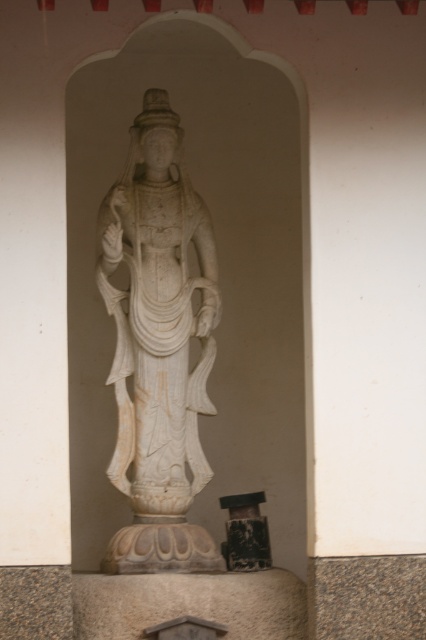
You are an architect designing a new museum exhibit and need to place a 1.5 meter wide display case between the white marble statue at center and the black textured pillar at center. Based on the scene description, will the display case fit between them?

The white marble statue at center is bigger than the black textured pillar at center, so the distance between them may not be sufficient to accommodate a 1.5 meter wide display case. Further measurements would be needed to confirm.

You are an interior designer planning to place a new decorative item in the space between the white marble statue at center and the black textured pillar at center. The item is 1.2 meters wide. Based on the scene description, will this item fit between them?

The white marble statue at center is wider than the black textured pillar at center. Since the statue is wider, the space between them may be insufficient for an item 1.2 meters wide. However, without exact measurements of the distance between them, it is difficult to confirm. The description only provides a comparison of their widths, not the distance between them. Therefore, the item might not fit, but the information provided is insufficient to determine conclusively.

You are standing in front of the statue and want to take a photo of the point at coordinates point (135, 435). If your camera has a maximum focus range of 40 meters, will you be able to focus on that point?

The distance of point (135, 435) from the camera is 44.75 meters, which exceeds the camera maximum focus range of 40 meters. Therefore, you won not be able to focus on that point.